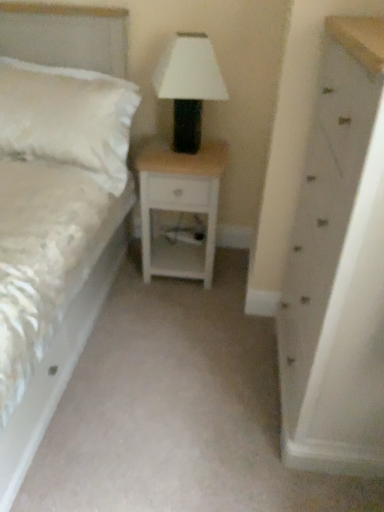
Question: Is white painted wood chest of drawers at right thinner than white fluffy pillow at left?

Choices:
 (A) no
 (B) yes

Answer: (A)

Question: Is white painted wood chest of drawers at right outside of white fluffy pillow at left?

Choices:
 (A) yes
 (B) no

Answer: (A)

Question: Is white painted wood chest of drawers at right positioned in front of white fluffy pillow at left?

Choices:
 (A) no
 (B) yes

Answer: (B)

Question: Considering the relative sizes of white painted wood chest of drawers at right and white fluffy pillow at left in the image provided, is white painted wood chest of drawers at right shorter than white fluffy pillow at left?

Choices:
 (A) no
 (B) yes

Answer: (A)

Question: From a real-world perspective, is white painted wood chest of drawers at right beneath white fluffy pillow at left?

Choices:
 (A) no
 (B) yes

Answer: (B)

Question: Does white painted wood chest of drawers at right have a greater width compared to white fluffy pillow at left?

Choices:
 (A) yes
 (B) no

Answer: (A)

Question: From a real-world perspective, is white satin bed at left physically below white wood nightstand at center?

Choices:
 (A) no
 (B) yes

Answer: (A)

Question: Considering the relative sizes of white satin bed at left and white wood nightstand at center in the image provided, is white satin bed at left thinner than white wood nightstand at center?

Choices:
 (A) no
 (B) yes

Answer: (A)

Question: Could you tell me if white satin bed at left is turned towards white wood nightstand at center?

Choices:
 (A) yes
 (B) no

Answer: (B)

Question: Would you say white satin bed at left is a long distance from white wood nightstand at center?

Choices:
 (A) yes
 (B) no

Answer: (B)

Question: From the image's perspective, is white satin bed at left below white wood nightstand at center?

Choices:
 (A) yes
 (B) no

Answer: (A)

Question: Is white satin bed at left positioned behind white wood nightstand at center?

Choices:
 (A) no
 (B) yes

Answer: (A)

Question: Is white fluffy pillow at left completely or partially outside of white satin bed at left?

Choices:
 (A) yes
 (B) no

Answer: (B)